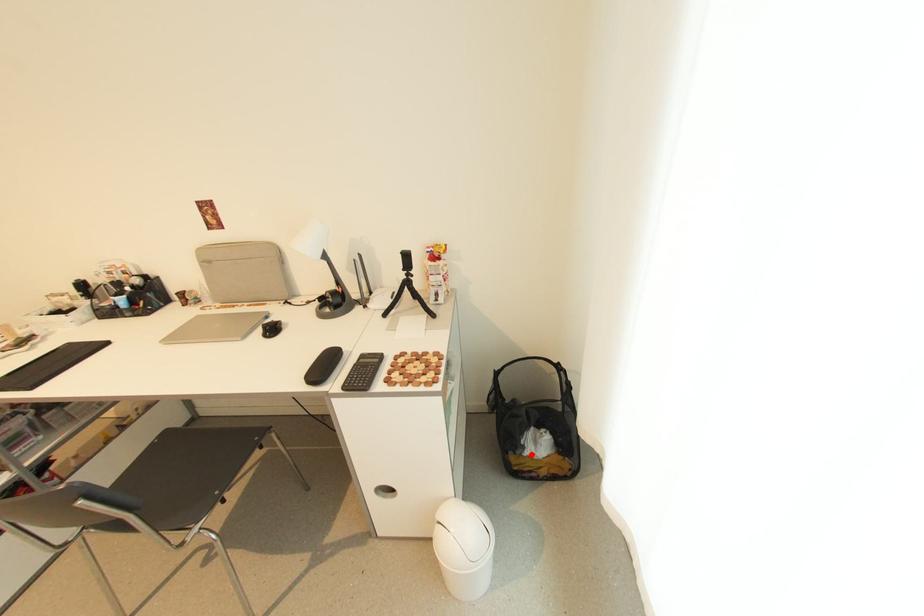
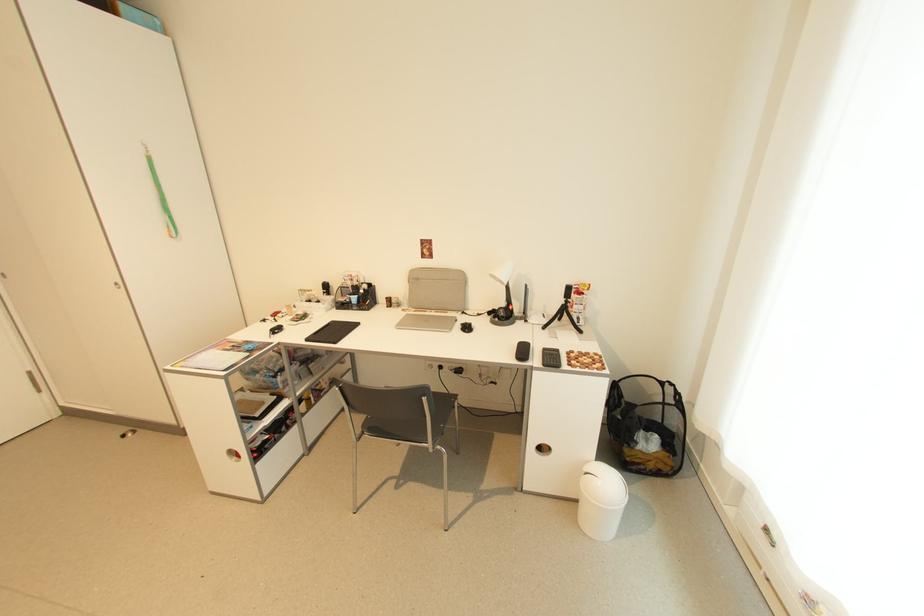
In the second image, find the point that corresponds to the highlighted location in the first image.

(642, 450)